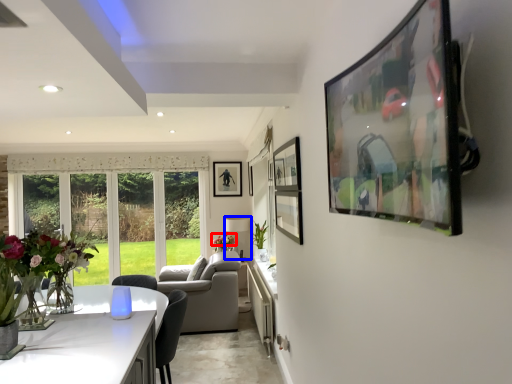
Question: Which of the following is the farthest to the observer, flower (highlighted by a red box) or lamp (highlighted by a blue box)?

Choices:
 (A) flower
 (B) lamp

Answer: (B)